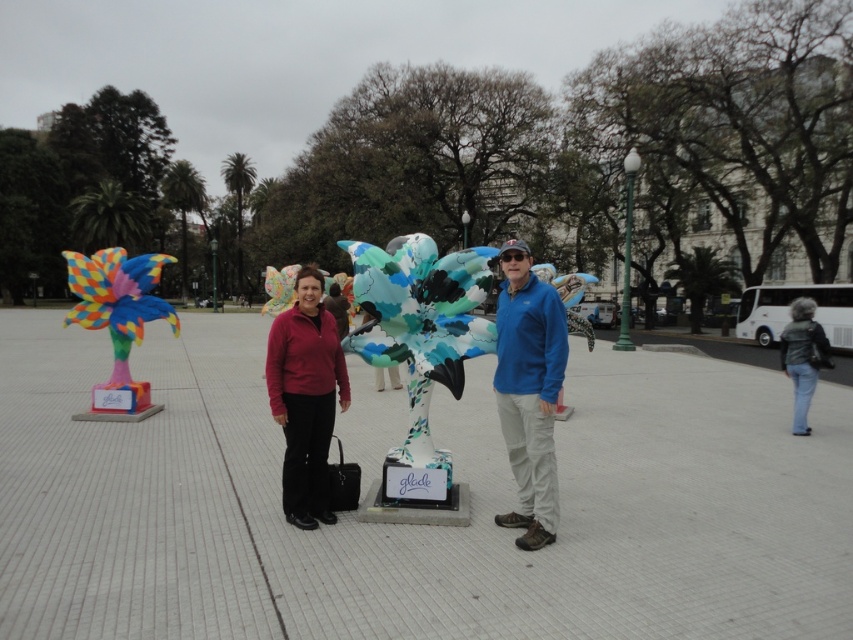
Can you confirm if matte multicolored sculpture at center is wider than multicolored painted bird at left?

No, matte multicolored sculpture at center is not wider than multicolored painted bird at left.

Between matte multicolored sculpture at center and multicolored painted bird at left, which one appears on the left side from the viewer's perspective?

From the viewer's perspective, multicolored painted bird at left appears more on the left side.

Which is behind, point (532, 401) or point (140, 342)?

Point (140, 342)

The height and width of the screenshot is (640, 853). Find the location of `matte multicolored sculpture at center`. matte multicolored sculpture at center is located at coordinates (436, 326).

Does blue fleece jacket at center lie in front of denim jacket at right?

Yes, it is in front of denim jacket at right.

Is blue fleece jacket at center wider than denim jacket at right?

No, blue fleece jacket at center is not wider than denim jacket at right.

Is point (544, 372) closer to viewer compared to point (814, 323)?

Yes, point (544, 372) is in front of point (814, 323).

Find the location of a particular element. blue fleece jacket at center is located at coordinates (529, 392).

You are a GUI agent. You are given a task and a screenshot of the screen. Output one action in this format:
    pyautogui.click(x=<x>, y=<y>)
    Task: Click on the blue fleece jacket at center
    This screenshot has height=640, width=853.
    Given the screenshot: What is the action you would take?
    pyautogui.click(x=529, y=392)

Does blue fleece jacket at center appear over matte red sweater at center?

Yes, blue fleece jacket at center is above matte red sweater at center.

Measure the distance between point (544, 406) and camera.

Point (544, 406) is 4.14 meters away from camera.

Locate an element on the screen. blue fleece jacket at center is located at coordinates (529, 392).